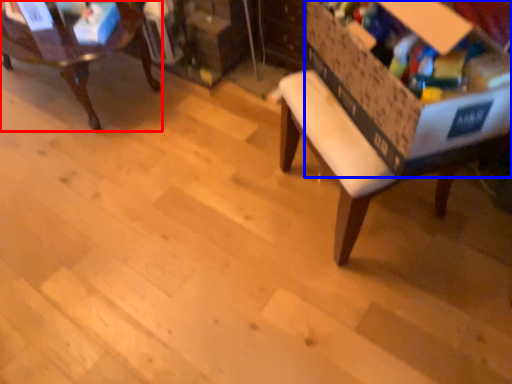
Question: Among these objects, which one is nearest to the camera, chair (highlighted by a red box) or storage box (highlighted by a blue box)?

Choices:
 (A) chair
 (B) storage box

Answer: (B)